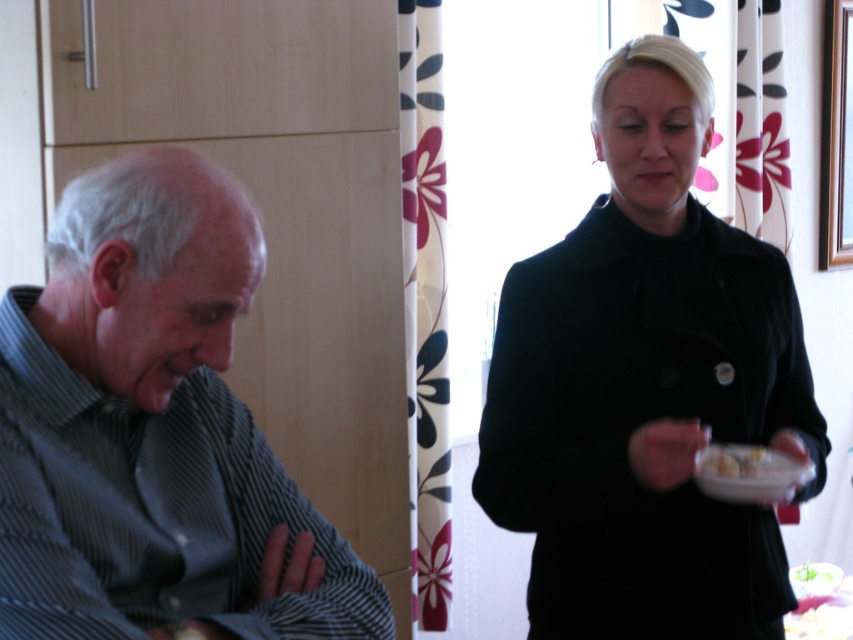
Question: Among these points, which one is farthest from the camera?

Choices:
 (A) (740, 564)
 (B) (374, 573)

Answer: (A)

Question: Estimate the real-world distances between objects in this image. Which object is closer to the white glossy bowl at upper right?

Choices:
 (A) striped shirt at left
 (B) black matte coat at center

Answer: (B)

Question: Is black matte coat at center above white glossy bowl at upper right?

Choices:
 (A) no
 (B) yes

Answer: (B)

Question: From the image, what is the correct spatial relationship of black matte coat at center in relation to striped shirt at left?

Choices:
 (A) left
 (B) right

Answer: (B)

Question: Can you confirm if black matte coat at center is smaller than white glossy bowl at upper right?

Choices:
 (A) no
 (B) yes

Answer: (A)

Question: Which of the following is the closest to the observer?

Choices:
 (A) white glossy bowl at upper right
 (B) black matte coat at center
 (C) striped shirt at left

Answer: (C)